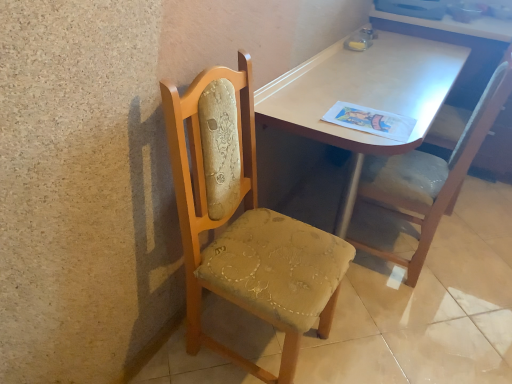
Question: Does light brown wood table at center have a greater height compared to wooden chair at left?

Choices:
 (A) no
 (B) yes

Answer: (B)

Question: Is the position of light brown wood table at center less distant than that of wooden chair at left?

Choices:
 (A) no
 (B) yes

Answer: (A)

Question: From the image's perspective, would you say light brown wood table at center is positioned over wooden chair at left?

Choices:
 (A) yes
 (B) no

Answer: (A)

Question: Is light brown wood table at center positioned behind wooden chair at left?

Choices:
 (A) yes
 (B) no

Answer: (A)

Question: Is there a large distance between light brown wood table at center and wooden chair at left?

Choices:
 (A) yes
 (B) no

Answer: (B)

Question: Is point (312, 297) positioned closer to the camera than point (419, 115)?

Choices:
 (A) closer
 (B) farther

Answer: (A)

Question: Considering their positions, is woodenchair at left, which is the second chair from right to left, located in front of or behind light brown wood table at center?

Choices:
 (A) front
 (B) behind

Answer: (A)

Question: Would you say woodenchair at left, which is the second chair from right to left, is to the left or to the right of light brown wood table at center in the picture?

Choices:
 (A) left
 (B) right

Answer: (A)

Question: Is woodenchair at left, the 1th chair viewed from the left, inside the boundaries of light brown wood table at center, or outside?

Choices:
 (A) inside
 (B) outside

Answer: (B)

Question: Would you say wooden chair at left is to the left or to the right of light brown wood table at center in the picture?

Choices:
 (A) right
 (B) left

Answer: (A)

Question: Is point (439, 374) positioned closer to the camera than point (446, 72)?

Choices:
 (A) farther
 (B) closer

Answer: (B)

Question: Is wooden chair at left inside the boundaries of light brown wood table at center, or outside?

Choices:
 (A) outside
 (B) inside

Answer: (A)

Question: Looking at the image, does wooden chair at left seem bigger or smaller compared to light brown wood table at center?

Choices:
 (A) small
 (B) big

Answer: (A)

Question: From their relative heights in the image, would you say velvet upholstered chair at right, the second chair when ordered from left to right, is taller or shorter than light brown wood table at center?

Choices:
 (A) short
 (B) tall

Answer: (B)

Question: Considering the positions of point (453, 152) and point (267, 94), is point (453, 152) closer or farther from the camera than point (267, 94)?

Choices:
 (A) farther
 (B) closer

Answer: (A)